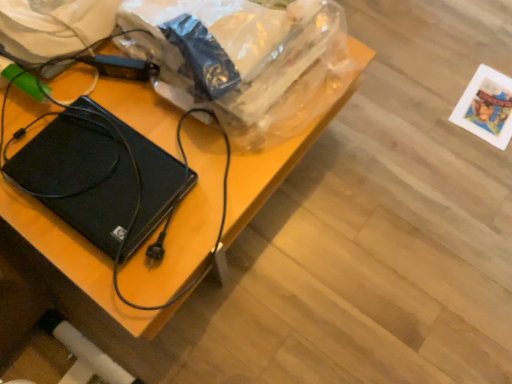
Locate an element on the screen. Image resolution: width=512 pixels, height=384 pixels. black matte laptop at left is located at coordinates (99, 177).

Measure the distance between plastic bag at upper center and camera.

35.45 inches.

What are the coordinates of `plastic bag at upper center` in the screenshot? It's located at (245, 60).

Locate an element on the screen. black plastic hard drive at center is located at coordinates (183, 225).

This screenshot has height=384, width=512. I want to click on black matte laptop at left, so click(x=99, y=177).

Would you say black plastic hard drive at center contains black matte laptop at left?

No, black plastic hard drive at center does not contain black matte laptop at left.

Which of these two, black plastic hard drive at center or black matte laptop at left, stands shorter?

black matte laptop at left.

How different are the orientations of black plastic hard drive at center and black matte laptop at left in degrees?

There is a 90-degree angle between the facing directions of black plastic hard drive at center and black matte laptop at left.

Considering the relative positions of black plastic hard drive at center and black matte laptop at left in the image provided, is black plastic hard drive at center to the left of black matte laptop at left from the viewer's perspective?

No, black plastic hard drive at center is not to the left of black matte laptop at left.

Is black plastic hard drive at center to the left or to the right of plastic bag at upper center in the image?

Based on their positions, black plastic hard drive at center is located to the left of plastic bag at upper center.

Is point (114, 110) closer to camera compared to point (166, 16)?

No, (114, 110) is behind (166, 16).

Which of these two, black plastic hard drive at center or plastic bag at upper center, is bigger?

black plastic hard drive at center is bigger.

From a real-world perspective, which is physically above, black matte laptop at left or plastic bag at upper center?

From a 3D spatial view, plastic bag at upper center is above.

Which is behind, black matte laptop at left or plastic bag at upper center?

black matte laptop at left is further away from the camera.

Can you see black matte laptop at left touching plastic bag at upper center?

black matte laptop at left is not next to plastic bag at upper center, and they're not touching.

Which is correct: black matte laptop at left is inside plastic bag at upper center, or outside of it?

The correct answer is: outside.

Find the location of `desk beneath the plastic bag at upper center (from a real-world perspective)`. desk beneath the plastic bag at upper center (from a real-world perspective) is located at coordinates 183,225.

From the image's perspective, which one is positioned lower, plastic bag at upper center or black plastic hard drive at center?

black plastic hard drive at center appears lower in the image.

Measure the distance from plastic bag at upper center to black plastic hard drive at center.

6.38 inches.

Does plastic bag at upper center come in front of black plastic hard drive at center?

Yes.

How distant is black matte laptop at left from black plastic hard drive at center?

black matte laptop at left and black plastic hard drive at center are 3.70 inches apart.

Considering the relative sizes of black matte laptop at left and black plastic hard drive at center in the image provided, is black matte laptop at left shorter than black plastic hard drive at center?

Indeed, black matte laptop at left has a lesser height compared to black plastic hard drive at center.

Consider the image. Between black matte laptop at left and black plastic hard drive at center, which one has smaller width?

Thinner between the two is black matte laptop at left.

Where is `desk in front of the black matte laptop at left`? Image resolution: width=512 pixels, height=384 pixels. desk in front of the black matte laptop at left is located at coordinates (183, 225).

From a real-world perspective, which is physically below, plastic bag at upper center or black matte laptop at left?

black matte laptop at left is physically lower.

Is plastic bag at upper center in contact with black matte laptop at left?

They are not placed beside each other.

Is plastic bag at upper center taller than black matte laptop at left?

Yes, plastic bag at upper center is taller than black matte laptop at left.

Considering the sizes of objects plastic bag at upper center and black matte laptop at left in the image provided, who is bigger, plastic bag at upper center or black matte laptop at left?

plastic bag at upper center is bigger.

This screenshot has height=384, width=512. I want to click on desk that appears above the black matte laptop at left (from the image's perspective), so click(183, 225).

Where is `grocery bag in front of the black plastic hard drive at center`? This screenshot has width=512, height=384. grocery bag in front of the black plastic hard drive at center is located at coordinates (x=245, y=60).

Looking at this image, based on their spatial positions, is plastic bag at upper center or black matte laptop at left further from black plastic hard drive at center?

Among the two, plastic bag at upper center is located further to black plastic hard drive at center.

From the picture: Looking at the image, which one is located closer to black matte laptop at left, black plastic hard drive at center or plastic bag at upper center?

black plastic hard drive at center is closer to black matte laptop at left.

When comparing their distances from black matte laptop at left, does plastic bag at upper center or black plastic hard drive at center seem closer?

Among the two, black plastic hard drive at center is located nearer to black matte laptop at left.

Which object lies further to the anchor point black plastic hard drive at center, black matte laptop at left or plastic bag at upper center?

Based on the image, plastic bag at upper center appears to be further to black plastic hard drive at center.

Considering their positions, is black plastic hard drive at center positioned further to plastic bag at upper center than black matte laptop at left?

The object further to plastic bag at upper center is black matte laptop at left.

From the image, which object appears to be farther from plastic bag at upper center, black matte laptop at left or black plastic hard drive at center?

Among the two, black matte laptop at left is located further to plastic bag at upper center.

Locate an element on the screen. Image resolution: width=512 pixels, height=384 pixels. desk between plastic bag at upper center and black matte laptop at left vertically is located at coordinates (183, 225).